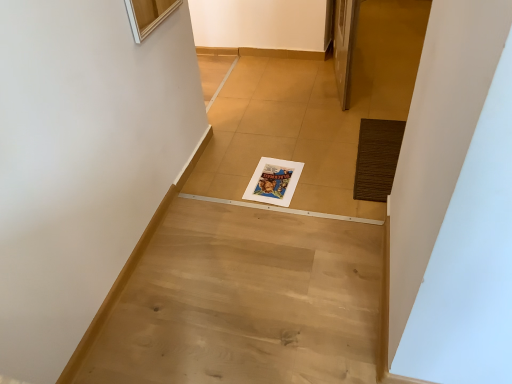
Question: Can you confirm if light wood floor at center is positioned to the left of brown textured mat at right?

Choices:
 (A) yes
 (B) no

Answer: (A)

Question: Is light wood floor at center beside brown textured mat at right?

Choices:
 (A) yes
 (B) no

Answer: (B)

Question: Considering the relative sizes of light wood floor at center and brown textured mat at right in the image provided, is light wood floor at center wider than brown textured mat at right?

Choices:
 (A) yes
 (B) no

Answer: (A)

Question: Can brown textured mat at right be found inside light wood floor at center?

Choices:
 (A) no
 (B) yes

Answer: (A)

Question: Can you confirm if light wood floor at center is smaller than brown textured mat at right?

Choices:
 (A) yes
 (B) no

Answer: (B)

Question: Would you say white paper magazine at center is to the left or to the right of brown textured mat at right in the picture?

Choices:
 (A) right
 (B) left

Answer: (B)

Question: In terms of height, does white paper magazine at center look taller or shorter compared to brown textured mat at right?

Choices:
 (A) tall
 (B) short

Answer: (A)

Question: From the image's perspective, is white paper magazine at center above or below brown textured mat at right?

Choices:
 (A) below
 (B) above

Answer: (A)

Question: Looking at the image, does white paper magazine at center seem bigger or smaller compared to brown textured mat at right?

Choices:
 (A) small
 (B) big

Answer: (A)

Question: Is point [272, 167] closer or farther from the camera than point [119, 370]?

Choices:
 (A) closer
 (B) farther

Answer: (B)

Question: From the image's perspective, is white paper magazine at center above or below light wood floor at center?

Choices:
 (A) above
 (B) below

Answer: (A)

Question: Is white paper magazine at center in front of or behind light wood floor at center in the image?

Choices:
 (A) front
 (B) behind

Answer: (B)

Question: Considering the relative positions of white paper magazine at center and light wood floor at center in the image provided, is white paper magazine at center to the left or to the right of light wood floor at center?

Choices:
 (A) left
 (B) right

Answer: (B)

Question: In terms of height, does light wood floor at center look taller or shorter compared to brown textured mat at right?

Choices:
 (A) tall
 (B) short

Answer: (B)

Question: Considering the positions of light wood floor at center and brown textured mat at right in the image, is light wood floor at center wider or thinner than brown textured mat at right?

Choices:
 (A) thin
 (B) wide

Answer: (B)